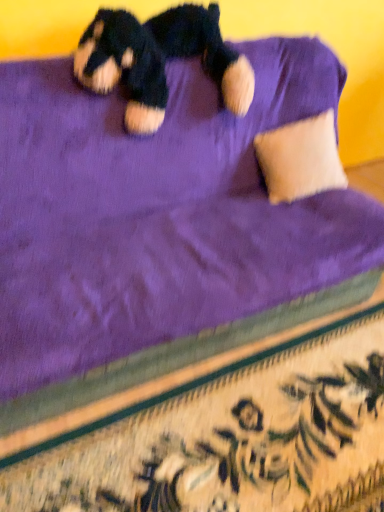
Question: From a real-world perspective, is soft plush teddy bear at upper center below beige soft pillow at upper right?

Choices:
 (A) yes
 (B) no

Answer: (B)

Question: Can you confirm if soft plush teddy bear at upper center is smaller than beige soft pillow at upper right?

Choices:
 (A) yes
 (B) no

Answer: (B)

Question: Is soft plush teddy bear at upper center outside beige soft pillow at upper right?

Choices:
 (A) yes
 (B) no

Answer: (A)

Question: From the image's perspective, is soft plush teddy bear at upper center on beige soft pillow at upper right?

Choices:
 (A) no
 (B) yes

Answer: (B)

Question: Does soft plush teddy bear at upper center have a lesser width compared to beige soft pillow at upper right?

Choices:
 (A) yes
 (B) no

Answer: (B)

Question: From a real-world perspective, does soft plush teddy bear at upper center stand above beige soft pillow at upper right?

Choices:
 (A) no
 (B) yes

Answer: (B)

Question: Considering the relative sizes of beige soft pillow at upper right and soft plush teddy bear at upper center in the image provided, is beige soft pillow at upper right taller than soft plush teddy bear at upper center?

Choices:
 (A) no
 (B) yes

Answer: (A)

Question: Is soft plush teddy bear at upper center a part of beige soft pillow at upper right?

Choices:
 (A) no
 (B) yes

Answer: (A)

Question: Considering the relative sizes of beige soft pillow at upper right and soft plush teddy bear at upper center in the image provided, is beige soft pillow at upper right shorter than soft plush teddy bear at upper center?

Choices:
 (A) yes
 (B) no

Answer: (A)

Question: From the image's perspective, is beige soft pillow at upper right located beneath soft plush teddy bear at upper center?

Choices:
 (A) no
 (B) yes

Answer: (B)

Question: Considering the relative positions of beige soft pillow at upper right and soft plush teddy bear at upper center in the image provided, is beige soft pillow at upper right in front of soft plush teddy bear at upper center?

Choices:
 (A) no
 (B) yes

Answer: (A)

Question: Considering the relative sizes of beige soft pillow at upper right and soft plush teddy bear at upper center in the image provided, is beige soft pillow at upper right bigger than soft plush teddy bear at upper center?

Choices:
 (A) no
 (B) yes

Answer: (A)

Question: In the image, is soft plush teddy bear at upper center positioned in front of or behind beige soft pillow at upper right?

Choices:
 (A) behind
 (B) front

Answer: (B)